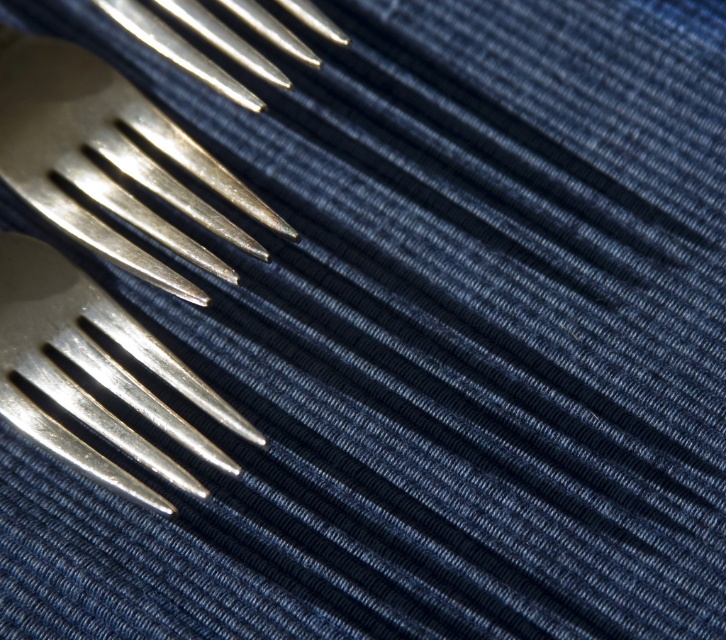
Question: From the image, what is the correct spatial relationship of polished silver fork at upper left in relation to polished silver fork at center?

Choices:
 (A) above
 (B) below

Answer: (A)

Question: Which object is closer to the camera taking this photo?

Choices:
 (A) polished silver fork at upper left
 (B) polished silver fork at center

Answer: (B)

Question: Can you confirm if polished silver fork at upper left is positioned to the right of polished silver fork at center?

Choices:
 (A) yes
 (B) no

Answer: (A)

Question: Which point is closer to the camera?

Choices:
 (A) (147, 172)
 (B) (61, 339)

Answer: (B)

Question: Is polished silver fork at upper left further to the viewer compared to polished silver fork at center?

Choices:
 (A) yes
 (B) no

Answer: (A)